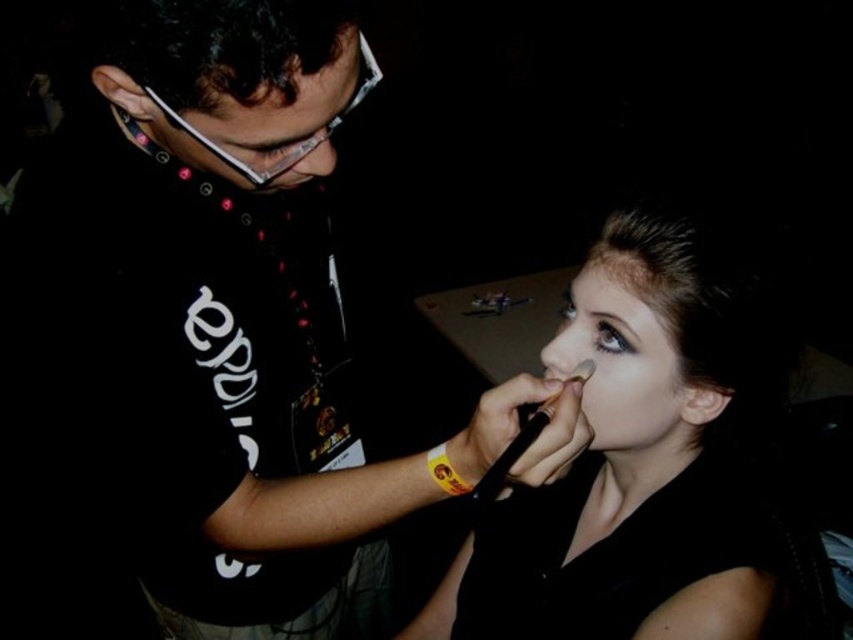
Question: Which of the following is the farthest from the observer?

Choices:
 (A) matte black shirt at center
 (B) matte black makeup brush at right
 (C) matte black face at center
 (D) matte black glasses at upper left

Answer: (B)

Question: Can you confirm if matte black shirt at center is thinner than matte black makeup brush at right?

Choices:
 (A) no
 (B) yes

Answer: (A)

Question: Estimate the real-world distances between objects in this image. Which object is closer to the brown matte eyebrow at upper center?

Choices:
 (A) matte black shirt at center
 (B) matte black glasses at upper left
 (C) matte black face at center

Answer: (C)

Question: Does matte black shirt at center appear on the right side of brown matte eyebrow at upper center?

Choices:
 (A) no
 (B) yes

Answer: (A)

Question: Is matte black shirt at center positioned at the back of matte black face at center?

Choices:
 (A) no
 (B) yes

Answer: (A)

Question: Among these objects, which one is farthest from the camera?

Choices:
 (A) matte black glasses at upper left
 (B) matte black makeup brush at right
 (C) matte black shirt at center

Answer: (B)